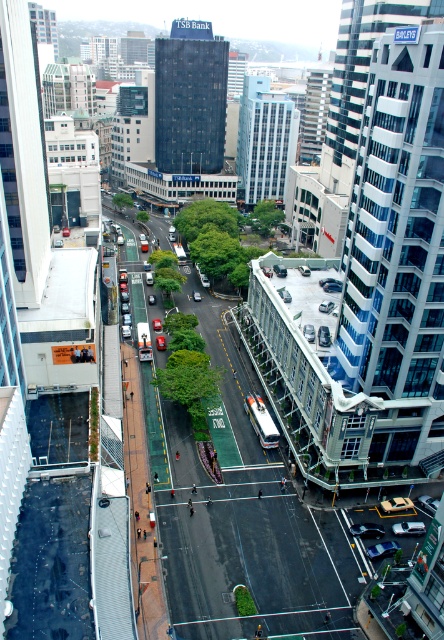
The image size is (444, 640). What do you see at coordinates (367, 529) in the screenshot? I see `shiny silver sedan at center` at bounding box center [367, 529].

Between shiny silver sedan at center and metallic silver car at lower right, which one appears on the right side from the viewer's perspective?

metallic silver car at lower right is more to the right.

Find the location of a particular element. shiny silver sedan at center is located at coordinates (367, 529).

Which is more to the left, shiny silver sedan at center or sleek silver sedan at center?

shiny silver sedan at center

Can you confirm if shiny silver sedan at center is thinner than sleek silver sedan at center?

No, shiny silver sedan at center is not thinner than sleek silver sedan at center.

Does point (356, 525) come farther from viewer compared to point (419, 531)?

Yes, point (356, 525) is behind point (419, 531).

Locate an element on the screen. The image size is (444, 640). shiny silver sedan at center is located at coordinates (367, 529).

Between point (379, 556) and point (399, 525), which one is positioned in front?

Point (379, 556) is more forward.

Which of these two, metallic silver car at lower right or sleek silver sedan at center, stands taller?

With more height is sleek silver sedan at center.

Is point (396, 541) closer to viewer compared to point (424, 529)?

Yes.

Where is `metallic silver car at lower right`? metallic silver car at lower right is located at coordinates (381, 548).